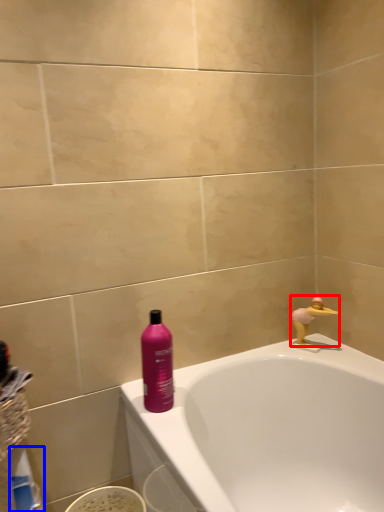
Question: Among these objects, which one is nearest to the camera, faucet (highlighted by a red box) or cleaning product (highlighted by a blue box)?

Choices:
 (A) faucet
 (B) cleaning product

Answer: (B)